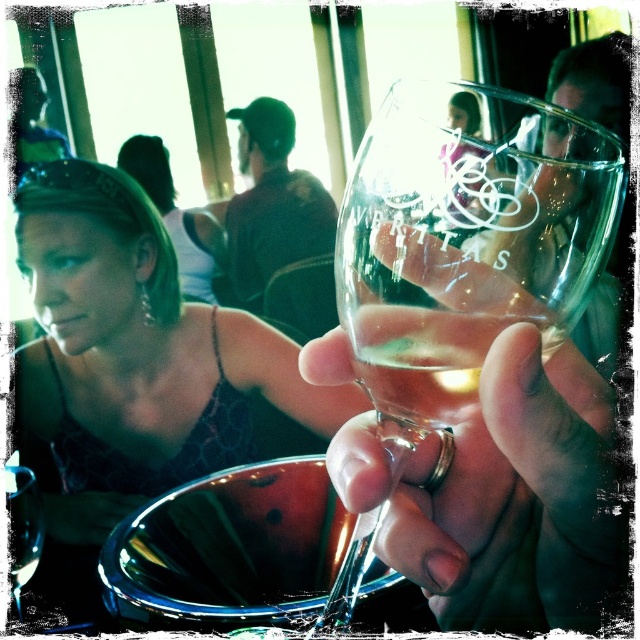
Is point (410, 304) positioned after point (180, 273)?

No, (410, 304) is in front of (180, 273).

Who is lower down, transparent glass wine glass at center or green hair at center?

transparent glass wine glass at center

At what (x,y) coordinates should I click in order to perform the action: click on transparent glass wine glass at center. Please return your answer as a coordinate pair (x, y). Looking at the image, I should click on (465, 241).

Is green hair at center smaller than clear glass wine glass at center?

No.

Find the location of `green hair at center`. green hair at center is located at coordinates (177, 218).

Does transparent glass wine glass at center come behind matte black dress at center?

That is False.

Identify the location of transparent glass wine glass at center. This screenshot has width=640, height=640. (465, 241).

Who is more forward, (438, 307) or (278, 364)?

Point (438, 307) is more forward.

The height and width of the screenshot is (640, 640). What are the coordinates of `transparent glass wine glass at center` in the screenshot? It's located at (465, 241).